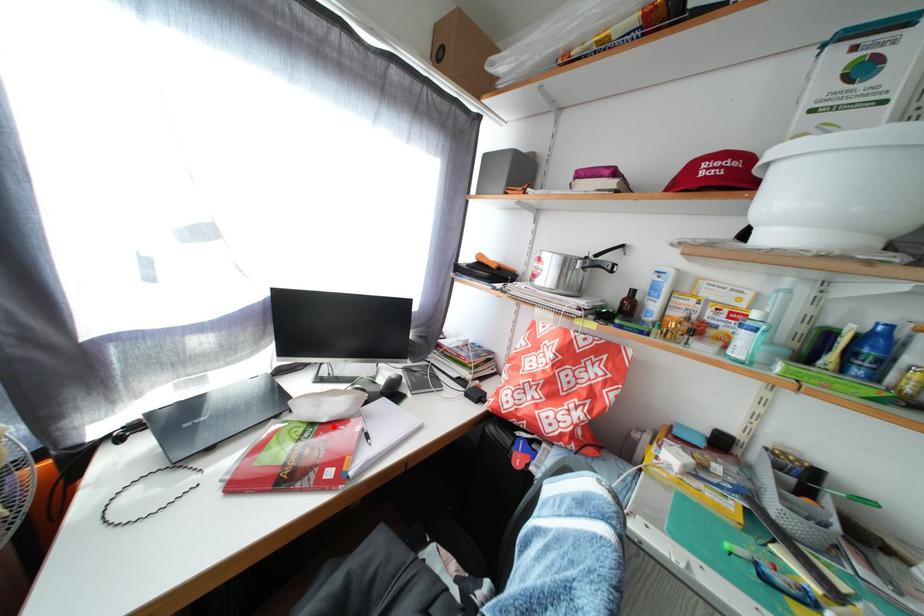
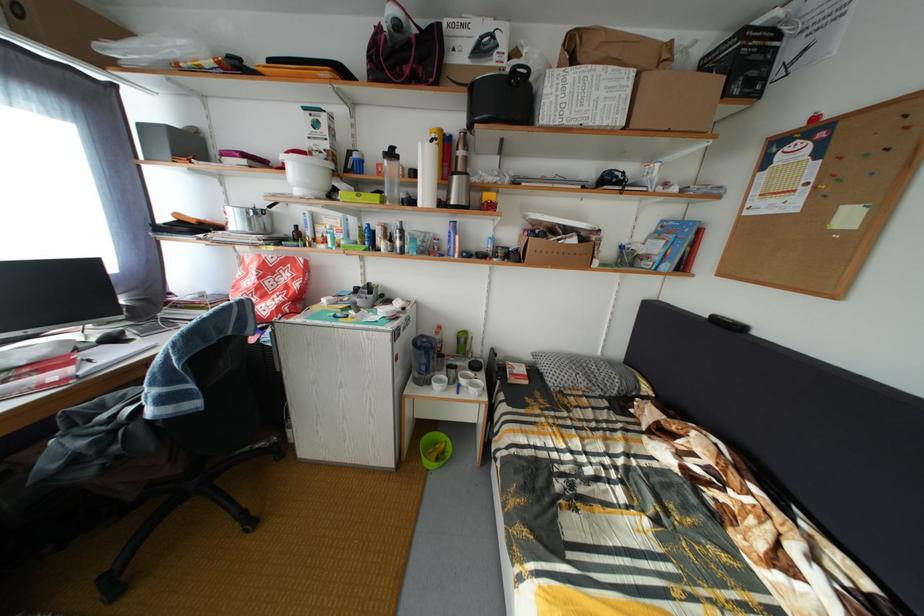
Locate, in the second image, the point that corresponds to the highlighted location in the first image.

(31, 370)